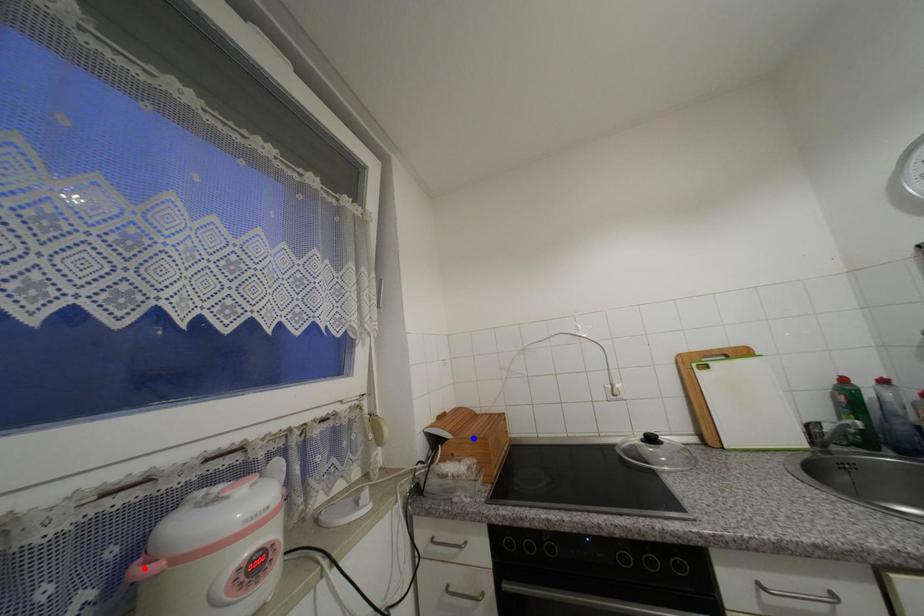
Question: In the image, two points are highlighted. Which point is nearer to the camera? Reply with the corresponding letter.

Choices:
 (A) blue point
 (B) red point

Answer: (B)